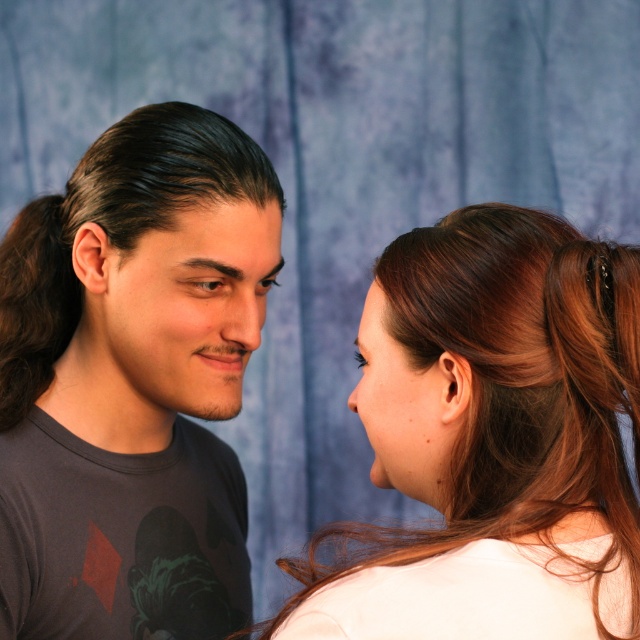
Does matte black t-shirt at left have a smaller size compared to smooth skin at center?

Actually, matte black t-shirt at left might be larger than smooth skin at center.

Does matte black t-shirt at left have a greater height compared to smooth skin at center?

Correct, matte black t-shirt at left is much taller as smooth skin at center.

Who is more distant from viewer, [104,429] or [248,259]?

The point [104,429] is behind.

You are a GUI agent. You are given a task and a screenshot of the screen. Output one action in this format:
    pyautogui.click(x=<x>, y=<y>)
    Task: Click on the matte black t-shirt at left
    The width and height of the screenshot is (640, 640).
    Given the screenshot: What is the action you would take?
    pyautogui.click(x=131, y=381)

Between brown hair at upper right and smooth skin at center, which one appears on the left side from the viewer's perspective?

smooth skin at center is more to the left.

Locate an element on the screen. Image resolution: width=640 pixels, height=640 pixels. brown hair at upper right is located at coordinates (492, 438).

Find the location of `brown hair at upper right`. brown hair at upper right is located at coordinates (492, 438).

Describe the element at coordinates (131, 381) in the screenshot. I see `matte black t-shirt at left` at that location.

Does matte black t-shirt at left have a smaller size compared to brown hair at upper right?

Actually, matte black t-shirt at left might be larger than brown hair at upper right.

Between point (12, 317) and point (636, 296), which one is positioned behind?

Positioned behind is point (12, 317).

Where is `matte black t-shirt at left`? matte black t-shirt at left is located at coordinates coord(131,381).